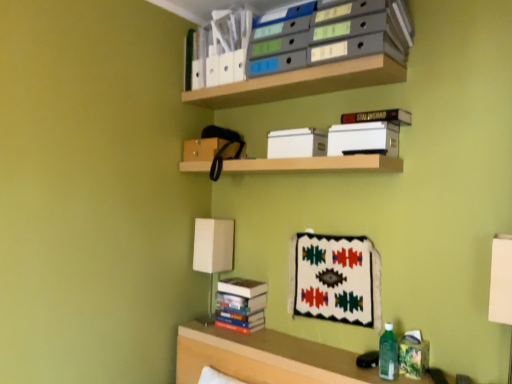
You are a GUI agent. You are given a task and a screenshot of the screen. Output one action in this format:
    pyautogui.click(x=<x>, y=<y>)
    Task: Click on the wooden shelf at center, arranged as the 2th shelf when viewed from the top
    
    Given the screenshot: What is the action you would take?
    pyautogui.click(x=317, y=164)

Find the location of a particular element. The height and width of the screenshot is (384, 512). matte gray file folders at upper center, marked as the first shelf in a top-to-bottom arrangement is located at coordinates (322, 55).

What do you see at coordinates (322, 55) in the screenshot? The width and height of the screenshot is (512, 384). I see `matte gray file folders at upper center, marked as the first shelf in a top-to-bottom arrangement` at bounding box center [322, 55].

What is the approximate width of white matte file folder at upper center, the first book positioned from the top?

white matte file folder at upper center, the first book positioned from the top, is 6.80 inches in width.

Image resolution: width=512 pixels, height=384 pixels. Describe the element at coordinates (362, 138) in the screenshot. I see `hardcover book at upper center, placed as the 2th paperback book when sorted from right to left` at that location.

Where is `wooden shelf at center, the 2th shelf in the bottom-to-top sequence`? This screenshot has width=512, height=384. wooden shelf at center, the 2th shelf in the bottom-to-top sequence is located at coordinates (x=317, y=164).

Is point (335, 44) positioned after point (241, 31)?

No, (335, 44) is in front of (241, 31).

Considering the relative sizes of matte gray file folders at upper center, marked as the first shelf in a top-to-bottom arrangement, and white matte file folder at upper center, the first book positioned from the top, in the image provided, is matte gray file folders at upper center, marked as the first shelf in a top-to-bottom arrangement, bigger than white matte file folder at upper center, the first book positioned from the top,?

Indeed, matte gray file folders at upper center, marked as the first shelf in a top-to-bottom arrangement, has a larger size compared to white matte file folder at upper center, the first book positioned from the top.

Where is `the 1st book behind when counting from the matte gray file folders at upper center, marked as the first shelf in a top-to-bottom arrangement`? The height and width of the screenshot is (384, 512). the 1st book behind when counting from the matte gray file folders at upper center, marked as the first shelf in a top-to-bottom arrangement is located at coordinates (221, 48).

In the image, is matte gray file folders at upper center, marked as the first shelf in a top-to-bottom arrangement, positioned in front of or behind white matte file folder at upper center, the first book positioned from the top?

matte gray file folders at upper center, marked as the first shelf in a top-to-bottom arrangement, is positioned closer to the viewer than white matte file folder at upper center, the first book positioned from the top.

Can you confirm if hardcover book at upper center, placed as the 2th paperback book when sorted from right to left, is positioned to the left of hardcover books at lower center, acting as the 2th book starting from the top?

In fact, hardcover book at upper center, placed as the 2th paperback book when sorted from right to left, is to the right of hardcover books at lower center, acting as the 2th book starting from the top.

Which object is more forward, hardcover book at upper center, acting as the 2th paperback book starting from the left, or hardcover books at lower center, which ranks as the first book in bottom-to-top order?

hardcover book at upper center, acting as the 2th paperback book starting from the left, is more forward.

Which point is more distant from viewer, [331,135] or [263,297]?

Point [263,297]

From the image's perspective, is hardcover book at upper center, placed as the 2th paperback book when sorted from right to left, positioned above or below hardcover books at lower center, which ranks as the first book in bottom-to-top order?

Clearly, from the image's perspective, hardcover book at upper center, placed as the 2th paperback book when sorted from right to left, is above hardcover books at lower center, which ranks as the first book in bottom-to-top order.

Between clear wood shelf at lower right, the first shelf when ordered from bottom to top, and matte gray file folders at upper center, marked as the first shelf in a top-to-bottom arrangement, which one has larger width?

Wider between the two is matte gray file folders at upper center, marked as the first shelf in a top-to-bottom arrangement.

Could you tell me if clear wood shelf at lower right, marked as the third shelf in a top-to-bottom arrangement, is turned towards matte gray file folders at upper center, marked as the first shelf in a top-to-bottom arrangement?

No, clear wood shelf at lower right, marked as the third shelf in a top-to-bottom arrangement, does not turn towards matte gray file folders at upper center, marked as the first shelf in a top-to-bottom arrangement.

I want to click on the 2nd shelf above the clear wood shelf at lower right, marked as the third shelf in a top-to-bottom arrangement (from the image's perspective), so click(x=322, y=55).

How different are the orientations of hardcover book at upper center, which is the 1th paperback book from right to left, and hardcover books at lower center, which ranks as the first book in bottom-to-top order, in degrees?

The facing directions of hardcover book at upper center, which is the 1th paperback book from right to left, and hardcover books at lower center, which ranks as the first book in bottom-to-top order, are 1.91 degrees apart.

Is hardcover book at upper center, which is the third paperback book from left to right, smaller than hardcover books at lower center, which ranks as the first book in bottom-to-top order?

Indeed, hardcover book at upper center, which is the third paperback book from left to right, has a smaller size compared to hardcover books at lower center, which ranks as the first book in bottom-to-top order.

Is point (352, 113) closer to viewer compared to point (224, 307)?

Yes, it is.

Would you say hardcover books at lower center, which ranks as the first book in bottom-to-top order, is part of hardcover book at upper center, which is the third paperback book from left to right,'s contents?

No, hardcover book at upper center, which is the third paperback book from left to right, does not contain hardcover books at lower center, which ranks as the first book in bottom-to-top order.

From the image's perspective, which one is positioned higher, hardcover books at lower center, acting as the 2th book starting from the top, or white fabric table lamp at left?

white fabric table lamp at left.

Is hardcover books at lower center, which ranks as the first book in bottom-to-top order, next to white fabric table lamp at left and touching it?

No, hardcover books at lower center, which ranks as the first book in bottom-to-top order, is not in contact with white fabric table lamp at left.

From their relative heights in the image, would you say white matte paper at upper center, which appears as the 3th paperback book when viewed from the right, is taller or shorter than wooden shelf at center, the 2th shelf in the bottom-to-top sequence?

Clearly, white matte paper at upper center, which appears as the 3th paperback book when viewed from the right, is taller compared to wooden shelf at center, the 2th shelf in the bottom-to-top sequence.

Which object is thinner, white matte paper at upper center, which appears as the 3th paperback book when viewed from the right, or wooden shelf at center, arranged as the 2th shelf when viewed from the top?

Thinner between the two is white matte paper at upper center, which appears as the 3th paperback book when viewed from the right.

Does white matte paper at upper center, which appears as the 3th paperback book when viewed from the right, appear on the right side of wooden shelf at center, the 2th shelf in the bottom-to-top sequence?

Indeed, white matte paper at upper center, which appears as the 3th paperback book when viewed from the right, is positioned on the right side of wooden shelf at center, the 2th shelf in the bottom-to-top sequence.

How different are the orientations of white matte paper at upper center, which appears as the 3th paperback book when viewed from the right, and wooden shelf at center, arranged as the 2th shelf when viewed from the top, in degrees?

The angle between the facing direction of white matte paper at upper center, which appears as the 3th paperback book when viewed from the right, and the facing direction of wooden shelf at center, arranged as the 2th shelf when viewed from the top, is 1.48 degrees.

Relative to hardcover book at upper center, which is the third paperback book from left to right, is white matte paper at upper center, which is the first paperback book in left-to-right order, in front or behind?

In the image, white matte paper at upper center, which is the first paperback book in left-to-right order, appears behind hardcover book at upper center, which is the third paperback book from left to right.

From the image's perspective, which object appears higher, white matte paper at upper center, which appears as the 3th paperback book when viewed from the right, or hardcover book at upper center, which is the third paperback book from left to right?

hardcover book at upper center, which is the third paperback book from left to right, appears higher in the image.

Is hardcover book at upper center, which is the 1th paperback book from right to left, inside white matte paper at upper center, which is the first paperback book in left-to-right order?

That's incorrect, hardcover book at upper center, which is the 1th paperback book from right to left, is not inside white matte paper at upper center, which is the first paperback book in left-to-right order.

Is white matte paper at upper center, which is the first paperback book in left-to-right order, far away from hardcover book at upper center, which is the 1th paperback book from right to left?

No, white matte paper at upper center, which is the first paperback book in left-to-right order, is not far away from hardcover book at upper center, which is the 1th paperback book from right to left.

This screenshot has width=512, height=384. In order to click on book above the matte gray file folders at upper center, arranged as the third shelf when ordered from the bottom (from the image's perspective) in this screenshot , I will do `click(221, 48)`.

This screenshot has height=384, width=512. In order to click on paperback book that is the 3rd one when counting forward from the hardcover books at lower center, acting as the 2th book starting from the top in this screenshot , I will do `click(362, 138)`.

When comparing their distances from white matte paper at upper center, which appears as the 3th paperback book when viewed from the right, does hardcover book at upper center, which is the third paperback book from left to right, or hardcover books at lower center, acting as the 2th book starting from the top, seem further?

Among the two, hardcover books at lower center, acting as the 2th book starting from the top, is located further to white matte paper at upper center, which appears as the 3th paperback book when viewed from the right.

Looking at the image, which one is located closer to hardcover book at upper center, placed as the 2th paperback book when sorted from right to left, hardcover book at upper center, which is the third paperback book from left to right, or white matte file folder at upper center, which ranks as the second book in bottom-to-top order?

hardcover book at upper center, which is the third paperback book from left to right, is positioned closer to the anchor hardcover book at upper center, placed as the 2th paperback book when sorted from right to left.

When comparing their distances from clear wood shelf at lower right, marked as the third shelf in a top-to-bottom arrangement, does wooden shelf at center, arranged as the 2th shelf when viewed from the top, or hardcover book at upper center, which is the third paperback book from left to right, seem closer?

Based on the image, wooden shelf at center, arranged as the 2th shelf when viewed from the top, appears to be nearer to clear wood shelf at lower right, marked as the third shelf in a top-to-bottom arrangement.

Considering their positions, is matte gray file folders at upper center, arranged as the third shelf when ordered from the bottom, positioned closer to clear wood shelf at lower right, marked as the third shelf in a top-to-bottom arrangement, than hardcover book at upper center, which is the third paperback book from left to right?

hardcover book at upper center, which is the third paperback book from left to right, is positioned closer to the anchor clear wood shelf at lower right, marked as the third shelf in a top-to-bottom arrangement.

Based on their spatial positions, is white matte file folder at upper center, which ranks as the second book in bottom-to-top order, or wooden shelf at center, arranged as the 2th shelf when viewed from the top, closer to green translucent bottle at lower right?

The object closer to green translucent bottle at lower right is wooden shelf at center, arranged as the 2th shelf when viewed from the top.

Estimate the real-world distances between objects in this image. Which object is further from clear wood shelf at lower right, the first shelf when ordered from bottom to top, white matte file folder at upper center, the first book positioned from the top, or hardcover book at upper center, which is the 1th paperback book from right to left?

white matte file folder at upper center, the first book positioned from the top.

Considering their positions, is white matte paper at upper center, which appears as the 3th paperback book when viewed from the right, positioned closer to clear wood shelf at lower right, the first shelf when ordered from bottom to top, than green translucent bottle at lower right?

Based on the image, green translucent bottle at lower right appears to be nearer to clear wood shelf at lower right, the first shelf when ordered from bottom to top.

From the image, which object appears to be farther from hardcover books at lower center, which ranks as the first book in bottom-to-top order, green translucent bottle at lower right or hardcover book at upper center, acting as the 2th paperback book starting from the left?

hardcover book at upper center, acting as the 2th paperback book starting from the left, lies further to hardcover books at lower center, which ranks as the first book in bottom-to-top order, than the other object.

The height and width of the screenshot is (384, 512). Identify the location of book between white matte file folder at upper center, the first book positioned from the top, and clear wood shelf at lower right, the first shelf when ordered from bottom to top, in the up-down direction. (241, 304).

Locate an element on the screen. This screenshot has width=512, height=384. shelf that lies between matte gray file folders at upper center, marked as the first shelf in a top-to-bottom arrangement, and hardcover books at lower center, which ranks as the first book in bottom-to-top order, from top to bottom is located at coordinates (317, 164).

This screenshot has height=384, width=512. What are the coordinates of `bottle located between clear wood shelf at lower right, marked as the third shelf in a top-to-bottom arrangement, and hardcover books at lower center, acting as the 2th book starting from the top, in the depth direction` in the screenshot? It's located at (388, 354).

Where is `shelf between hardcover book at upper center, acting as the 2th paperback book starting from the left, and green translucent bottle at lower right from top to bottom`? This screenshot has height=384, width=512. shelf between hardcover book at upper center, acting as the 2th paperback book starting from the left, and green translucent bottle at lower right from top to bottom is located at coordinates (317, 164).